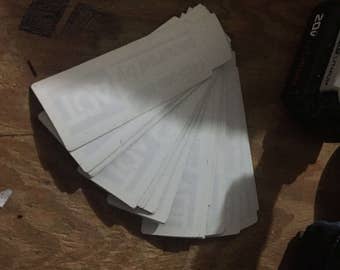
I want to click on white papers, so click(94, 93), click(105, 144), click(121, 171), click(151, 187), click(178, 212), click(192, 222), click(226, 216), click(234, 214), click(249, 208).